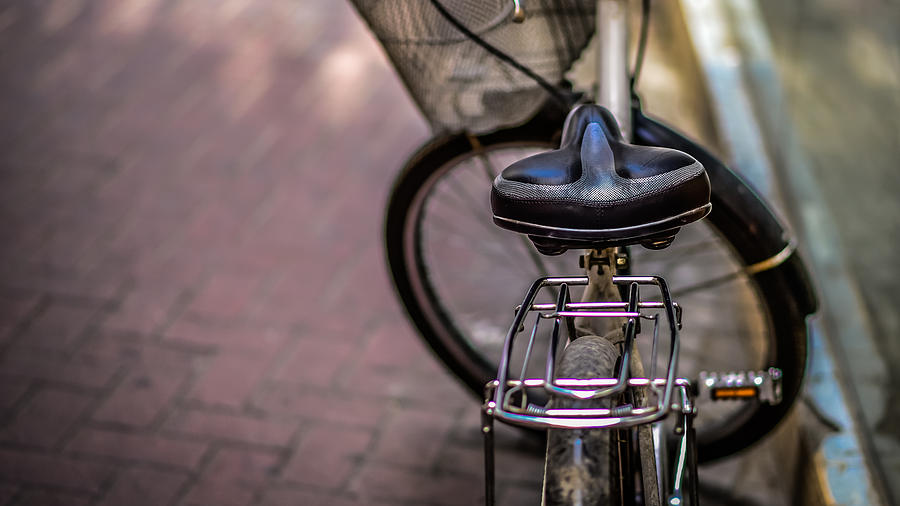
Locate an element on the screen. The width and height of the screenshot is (900, 506). basket is located at coordinates (477, 65).